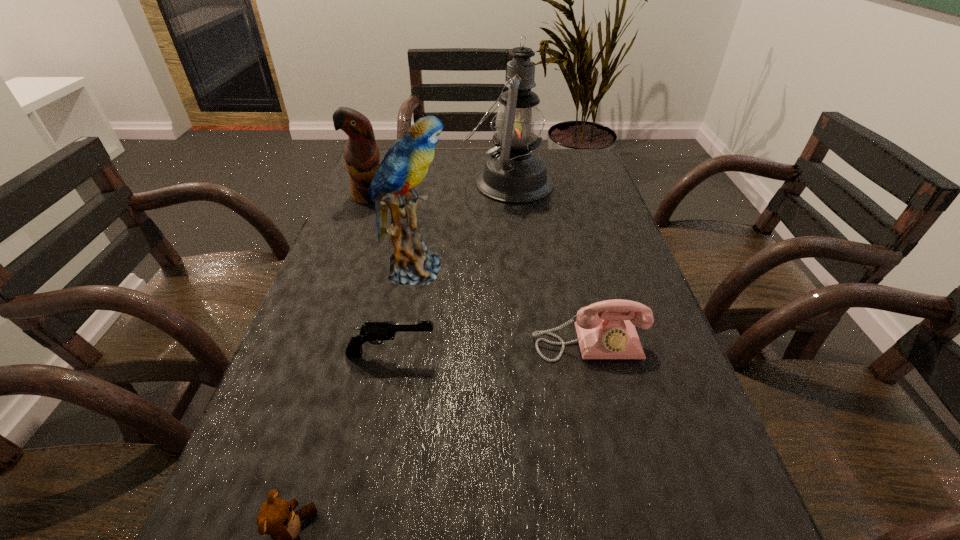
What are the coordinates of `oil lamp` in the screenshot? It's located at (513, 174).

Where is `the right parrot`? the right parrot is located at coordinates (406, 163).

Locate an element on the screen. the nearer parrot is located at coordinates (406, 163).

Find the location of a particular element. This screenshot has width=960, height=540. the third tallest object is located at coordinates (361, 155).

Find the location of a particular element. Image resolution: width=960 pixels, height=540 pixels. the shorter parrot is located at coordinates (361, 155).

Locate an element on the screen. telephone is located at coordinates (611, 334).

You are a GUI agent. You are given a task and a screenshot of the screen. Output one action in this format:
    pyautogui.click(x=<x>, y=<y>)
    Task: Click on the gun
    
    Given the screenshot: What is the action you would take?
    pyautogui.click(x=375, y=332)

You are a GUI agent. You are given a task and a screenshot of the screen. Output one action in this format:
    pyautogui.click(x=<x>, y=<y>)
    Task: Click on the vacant region located 0.290m on the left of the oil lamp
    The image size is (960, 540).
    Given the screenshot: What is the action you would take?
    pyautogui.click(x=366, y=183)

The width and height of the screenshot is (960, 540). I want to click on vacant space located 0.400m on the face of the right parrot, so click(626, 269).

Locate an element on the screen. vacant space located on the face of the left parrot is located at coordinates (344, 266).